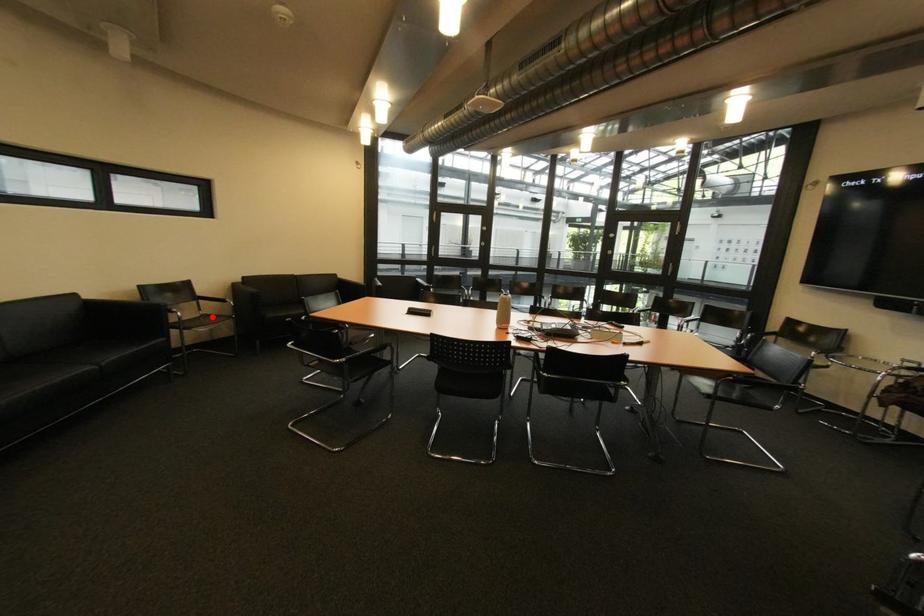
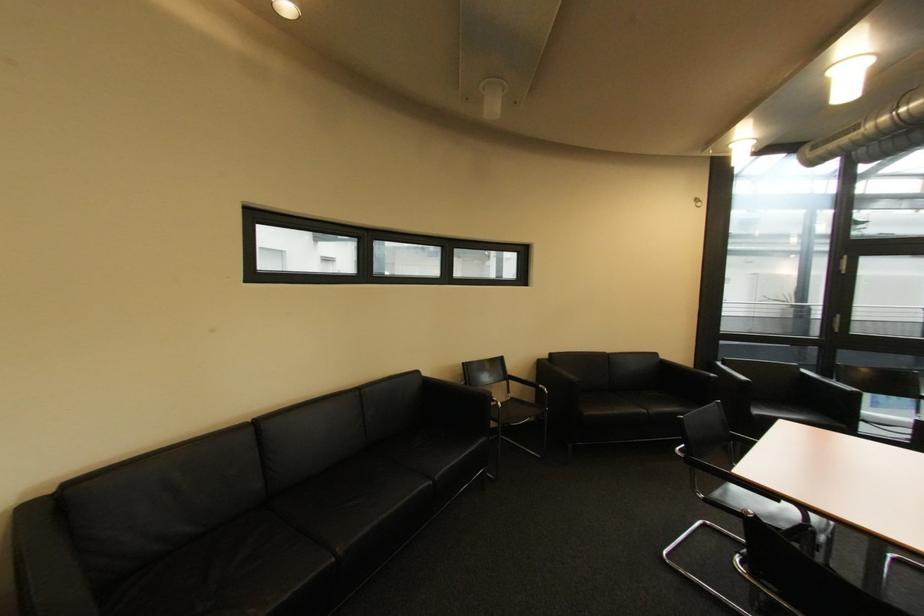
Question: I am providing you with two images of the same scene from different viewpoints. A red point is shown in image1. For the corresponding object point in image2, is it positioned nearer or farther from the camera?

Choices:
 (A) Nearer
 (B) Farther

Answer: (B)